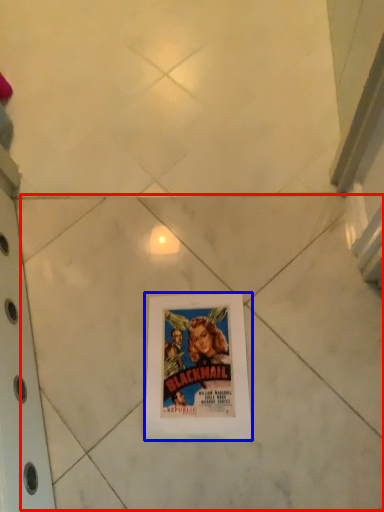
Question: Which object appears closest to the camera in this image, tile (highlighted by a red box) or picture frame (highlighted by a blue box)?

Choices:
 (A) tile
 (B) picture frame

Answer: (A)